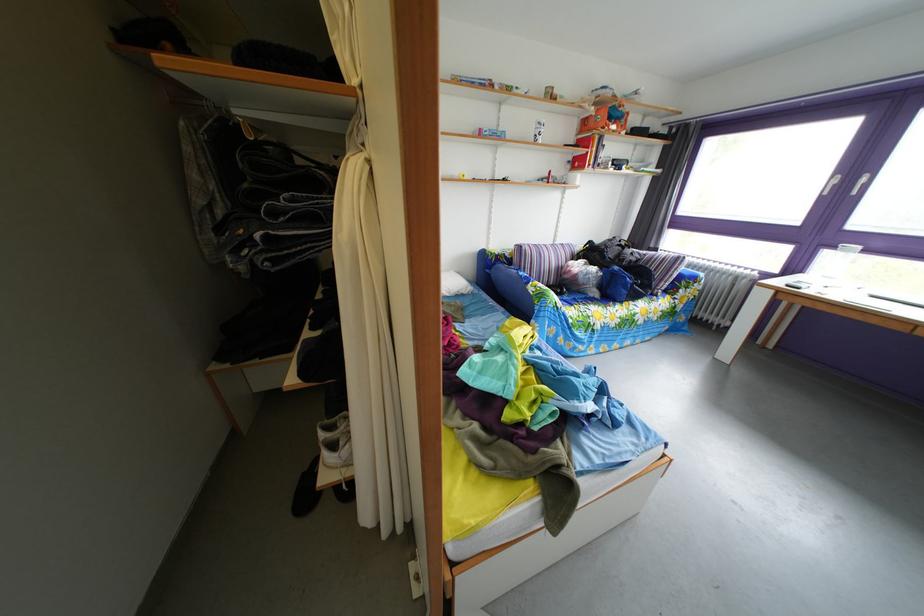
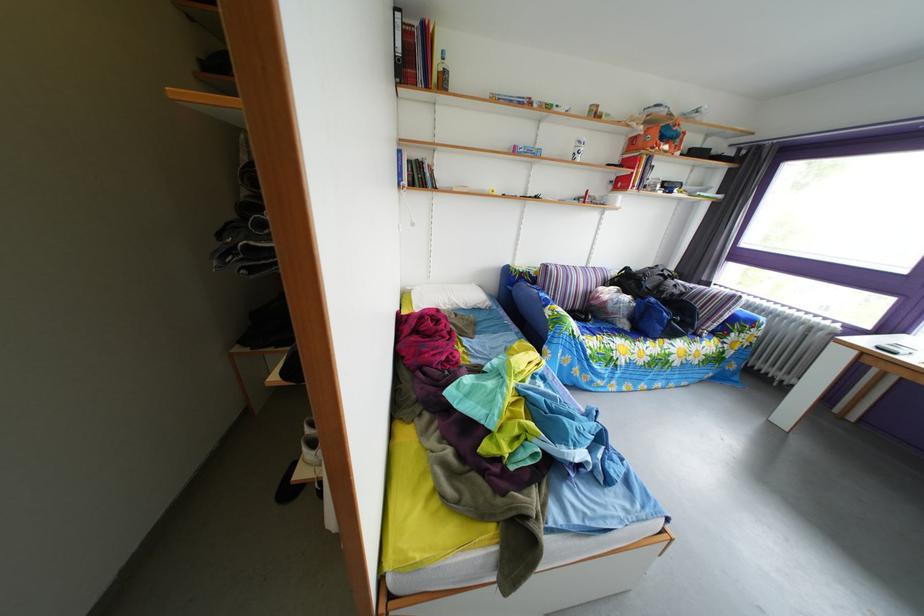
In the second image, find the point that corresponds to (621,128) in the first image.

(673, 147)